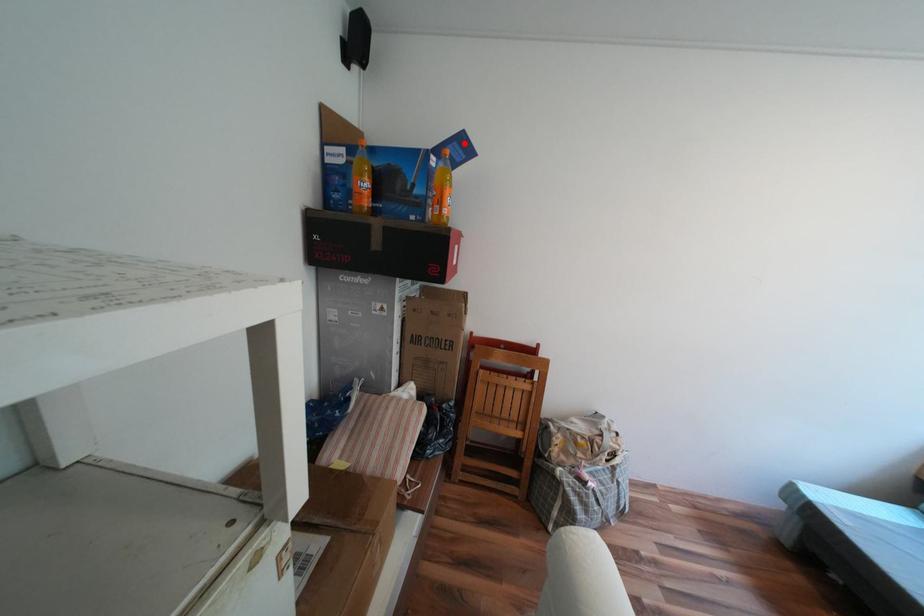
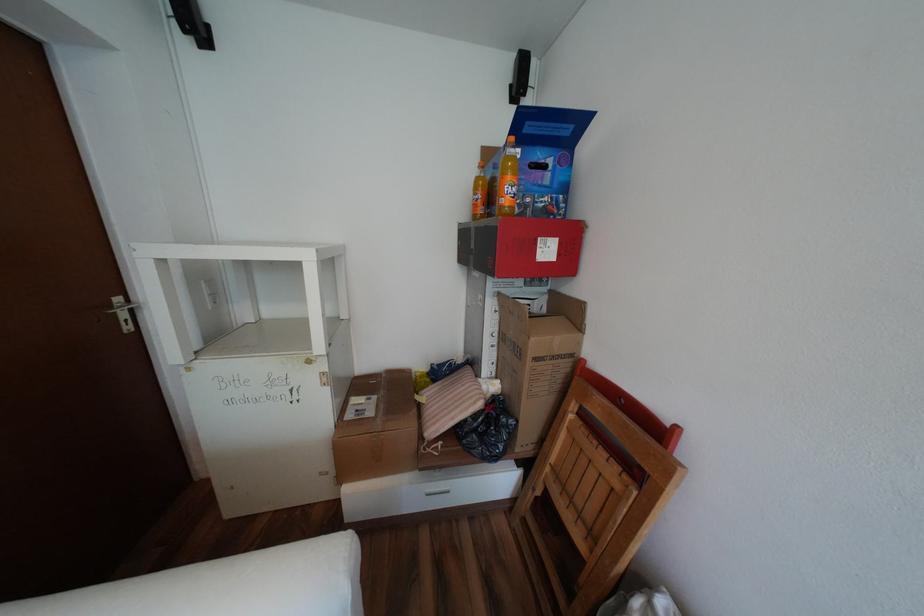
The point at the highlighted location is marked in the first image. Where is the corresponding point in the second image?

(537, 123)